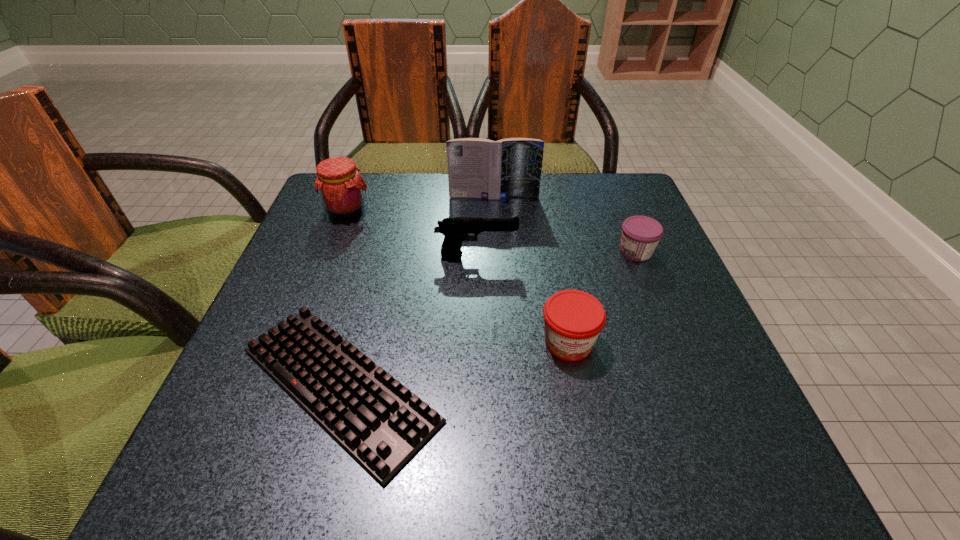
Locate an element on the screen. This screenshot has height=540, width=960. free location located 0.370m on the right of the farthest jam is located at coordinates (524, 210).

At what (x,y) coordinates should I click in order to perform the action: click on vacant space located on the front-facing side of the pistol. Please return your answer as a coordinate pair (x, y). The image size is (960, 540). Looking at the image, I should click on (592, 254).

Where is `vacant region located 0.180m on the label side of the third shortest object`? vacant region located 0.180m on the label side of the third shortest object is located at coordinates (593, 477).

The height and width of the screenshot is (540, 960). What are the coordinates of `vacant area situated on the front label of the second nearest jam` in the screenshot? It's located at (444, 252).

Locate an element on the screen. vacant space located 0.220m on the front label of the second nearest jam is located at coordinates (514, 252).

I want to click on free space located 0.300m on the front label of the second nearest jam, so click(x=476, y=252).

The image size is (960, 540). In order to click on free spot located 0.050m on the back of the shortest object in this screenshot , I will do `click(365, 292)`.

At what (x,y) coordinates should I click in order to perform the action: click on book located in the far edge section of the desktop. Please return your answer as a coordinate pair (x, y). Image resolution: width=960 pixels, height=540 pixels. Looking at the image, I should click on (479, 168).

Identify the location of jam at the far edge. click(x=341, y=188).

You are a GUI agent. You are given a task and a screenshot of the screen. Output one action in this format:
    pyautogui.click(x=<x>, y=<y>)
    Task: Click on the object that is positioned at the near edge
    The image size is (960, 540).
    Given the screenshot: What is the action you would take?
    pyautogui.click(x=381, y=423)